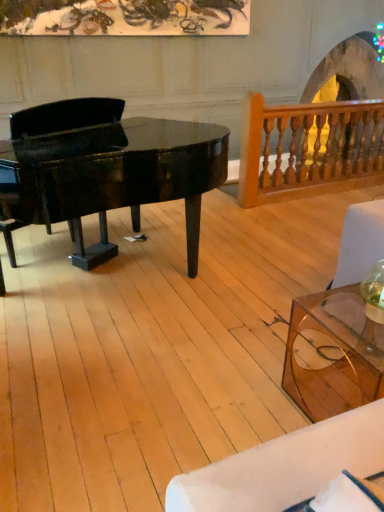
Question: Is transparent glass coffee table at lower right not within wooden baluster at upper right?

Choices:
 (A) yes
 (B) no

Answer: (A)

Question: Is transparent glass coffee table at lower right touching wooden baluster at upper right?

Choices:
 (A) yes
 (B) no

Answer: (B)

Question: Is transparent glass coffee table at lower right positioned with its back to wooden baluster at upper right?

Choices:
 (A) no
 (B) yes

Answer: (A)

Question: Is the position of transparent glass coffee table at lower right more distant than that of wooden baluster at upper right?

Choices:
 (A) yes
 (B) no

Answer: (B)

Question: Does transparent glass coffee table at lower right come in front of wooden baluster at upper right?

Choices:
 (A) no
 (B) yes

Answer: (B)

Question: Is transparent glass coffee table at lower right to the right of wooden baluster at upper right from the viewer's perspective?

Choices:
 (A) yes
 (B) no

Answer: (B)

Question: Would you consider wooden baluster at upper right to be distant from glossy black piano at left?

Choices:
 (A) no
 (B) yes

Answer: (B)

Question: From the image's perspective, is wooden baluster at upper right below glossy black piano at left?

Choices:
 (A) yes
 (B) no

Answer: (B)

Question: Is wooden baluster at upper right further to the viewer compared to glossy black piano at left?

Choices:
 (A) no
 (B) yes

Answer: (B)

Question: From a real-world perspective, is wooden baluster at upper right located beneath glossy black piano at left?

Choices:
 (A) yes
 (B) no

Answer: (A)

Question: Can you confirm if wooden baluster at upper right is positioned to the right of glossy black piano at left?

Choices:
 (A) no
 (B) yes

Answer: (B)

Question: Is wooden baluster at upper right facing towards glossy black piano at left?

Choices:
 (A) no
 (B) yes

Answer: (A)

Question: Is glossy black piano at left shorter than wooden baluster at upper right?

Choices:
 (A) yes
 (B) no

Answer: (B)